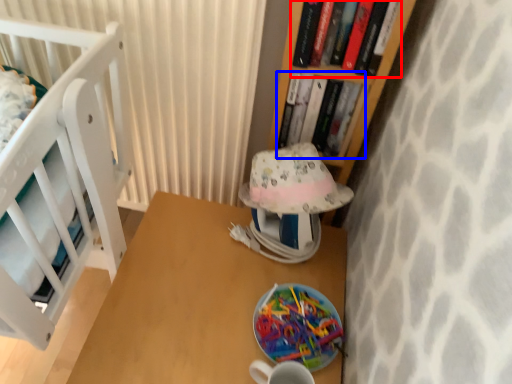
Question: Which object is closer to the camera taking this photo, book (highlighted by a red box) or book (highlighted by a blue box)?

Choices:
 (A) book
 (B) book

Answer: (A)